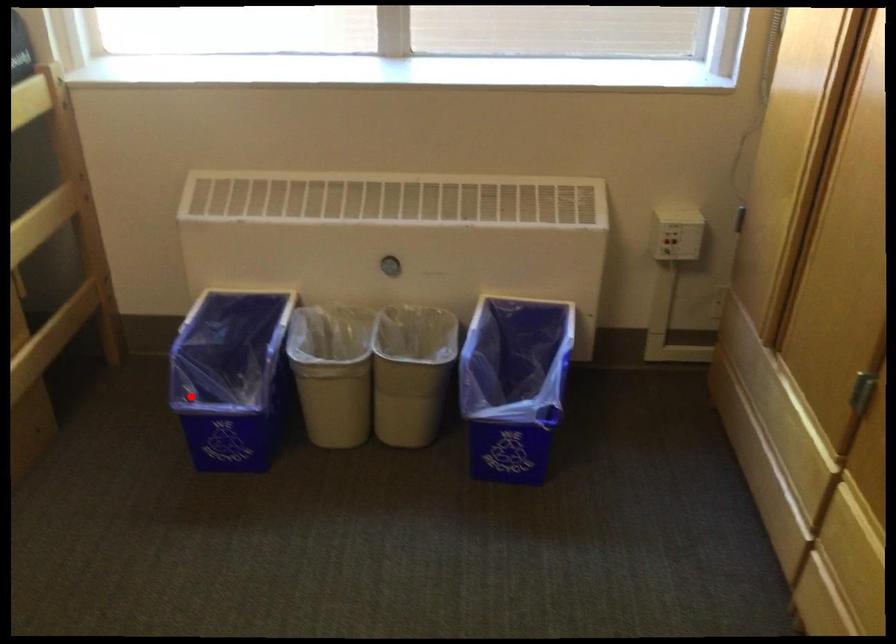
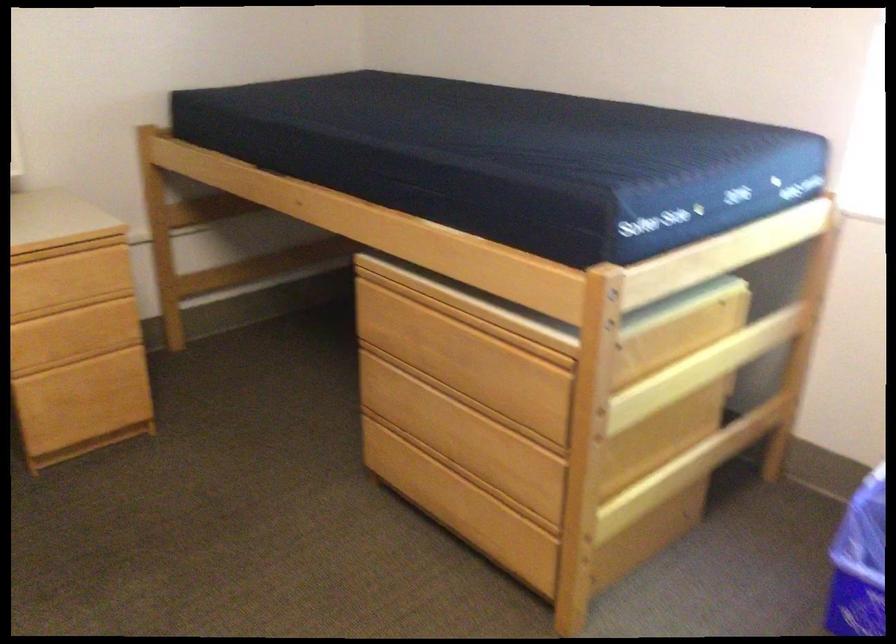
Question: I am providing you with two images of the same scene from different viewpoints. A red point is shown in image1. For the corresponding object point in image2, is it positioned nearer or farther from the camera?

Choices:
 (A) Nearer
 (B) Farther

Answer: (A)